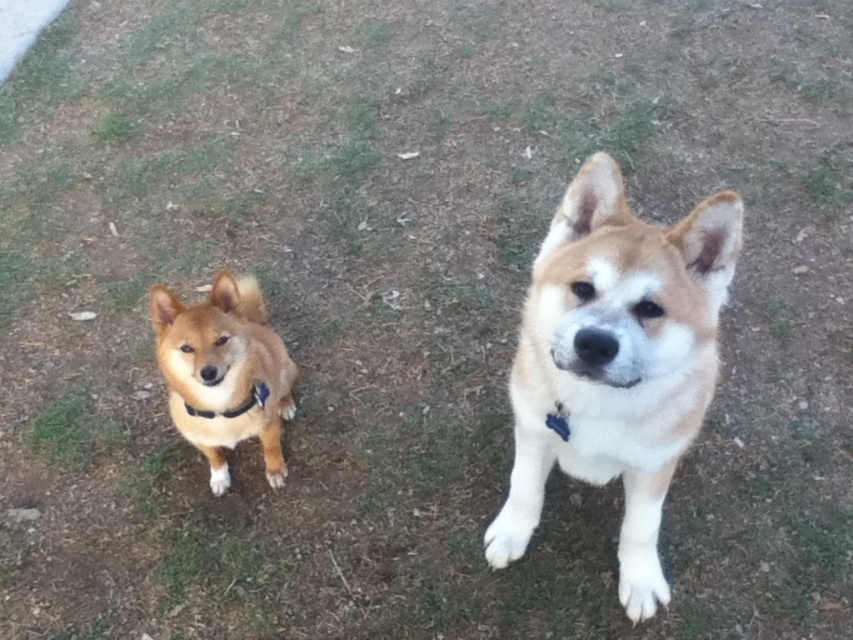
Question: Which point appears closest to the camera in this image?

Choices:
 (A) (225, 480)
 (B) (225, 410)

Answer: (B)

Question: Estimate the real-world distances between objects in this image. Which object is closer to the black fabric neckband at lower left?

Choices:
 (A) light brown fur dog at center
 (B) brown fur dog at left

Answer: (B)

Question: Which point is closer to the camera?

Choices:
 (A) light brown fur dog at center
 (B) brown fur dog at left

Answer: (A)

Question: Is light brown fur dog at center closer to camera compared to black fabric neckband at lower left?

Choices:
 (A) yes
 (B) no

Answer: (A)

Question: Can you confirm if light brown fur dog at center is positioned below black fabric neckband at lower left?

Choices:
 (A) no
 (B) yes

Answer: (A)

Question: Is light brown fur dog at center below black fabric neckband at lower left?

Choices:
 (A) no
 (B) yes

Answer: (A)